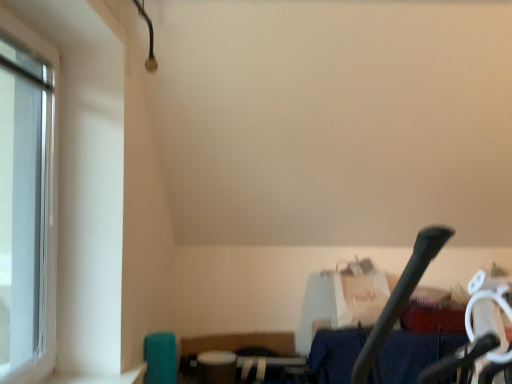
At what (x,y) coordinates should I click in order to perform the action: click on white glass window at left. Please return your answer as a coordinate pair (x, y). Looking at the image, I should click on (25, 208).

Describe the element at coordinates (25, 208) in the screenshot. I see `white glass window at left` at that location.

Locate an element on the screen. The image size is (512, 384). white glass window at left is located at coordinates (25, 208).